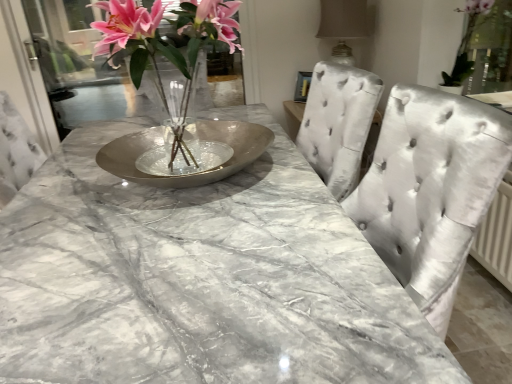
Question: Is metallic vase at center bigger or smaller than satin silver chair at center?

Choices:
 (A) small
 (B) big

Answer: (A)

Question: In terms of width, does metallic vase at center look wider or thinner when compared to satin silver chair at center?

Choices:
 (A) wide
 (B) thin

Answer: (B)

Question: Estimate the real-world distances between objects in this image. Which object is farther from the green leafy plant at upper right?

Choices:
 (A) satin beige lampshade at upper right
 (B) metallic vase at center
 (C) transparent glass door at upper left
 (D) satin silver chair at center
 (E) silver metallic bowl at center

Answer: (C)

Question: Which object is the closest to the green leafy plant at upper right?

Choices:
 (A) silver metallic bowl at center
 (B) satin silver chair at center
 (C) transparent glass door at upper left
 (D) metallic vase at center
 (E) satin beige lampshade at upper right

Answer: (E)